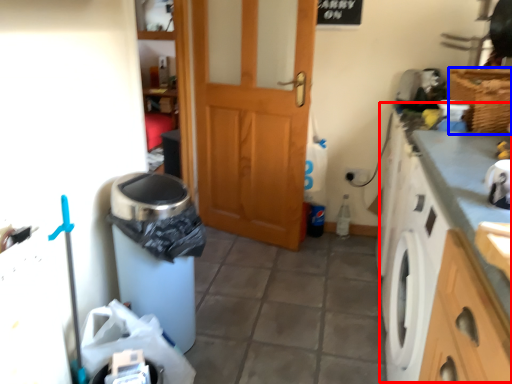
Question: Which point is further to the camera, counter top (highlighted by a red box) or basket (highlighted by a blue box)?

Choices:
 (A) counter top
 (B) basket

Answer: (B)